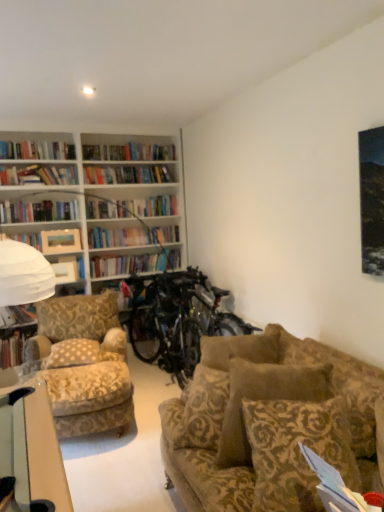
Question: Is hardcover book at left, the second book when ordered from top to bottom, not near brown patterned pillow at lower right, marked as the 1th pillow in a front-to-back arrangement?

Choices:
 (A) yes
 (B) no

Answer: (A)

Question: Is hardcover book at left, the second book when ordered from top to bottom, outside of brown patterned pillow at lower right, placed as the first pillow when sorted from right to left?

Choices:
 (A) yes
 (B) no

Answer: (A)

Question: Can you confirm if hardcover book at left, positioned as the 1th book in bottom-to-top order, is positioned to the right of brown patterned pillow at lower right, marked as the 1th pillow in a front-to-back arrangement?

Choices:
 (A) no
 (B) yes

Answer: (A)

Question: Does hardcover book at left, positioned as the 1th book in bottom-to-top order, come in front of brown patterned pillow at lower right, marked as the 1th pillow in a front-to-back arrangement?

Choices:
 (A) no
 (B) yes

Answer: (A)

Question: Is hardcover book at left, positioned as the 1th book in bottom-to-top order, thinner than brown patterned pillow at lower right, placed as the first pillow when sorted from right to left?

Choices:
 (A) yes
 (B) no

Answer: (A)

Question: Is hardcover book at left, positioned as the 1th book in bottom-to-top order, placed right next to brown patterned pillow at lower right, the 2th pillow in the left-to-right sequence?

Choices:
 (A) yes
 (B) no

Answer: (B)

Question: Can you confirm if hardcover book at left, positioned as the 1th book in bottom-to-top order, is smaller than matte wooden picture frame at upper left, which appears as the 2th picture frame when ordered from the bottom?

Choices:
 (A) yes
 (B) no

Answer: (B)

Question: Does hardcover book at left, positioned as the 1th book in bottom-to-top order, appear on the left side of matte wooden picture frame at upper left, which appears as the 2th picture frame when ordered from the bottom?

Choices:
 (A) no
 (B) yes

Answer: (B)

Question: Is hardcover book at left, positioned as the 1th book in bottom-to-top order, looking in the opposite direction of matte wooden picture frame at upper left, which appears as the 2th picture frame when ordered from the bottom?

Choices:
 (A) no
 (B) yes

Answer: (A)

Question: Is the position of hardcover book at left, the second book when ordered from top to bottom, more distant than that of matte wooden picture frame at upper left, which ranks as the 1th picture frame in top-to-bottom order?

Choices:
 (A) yes
 (B) no

Answer: (B)

Question: Can you confirm if hardcover book at left, positioned as the 1th book in bottom-to-top order, is shorter than matte wooden picture frame at upper left, which ranks as the 1th picture frame in top-to-bottom order?

Choices:
 (A) yes
 (B) no

Answer: (B)

Question: Is hardcover book at left, the second book when ordered from top to bottom, surrounding matte wooden picture frame at upper left, which ranks as the 1th picture frame in top-to-bottom order?

Choices:
 (A) no
 (B) yes

Answer: (A)

Question: Is metallic silver bicycle at center positioned in front of matte wooden picture frame at upper left, which appears as the 2th picture frame when ordered from the bottom?

Choices:
 (A) no
 (B) yes

Answer: (B)